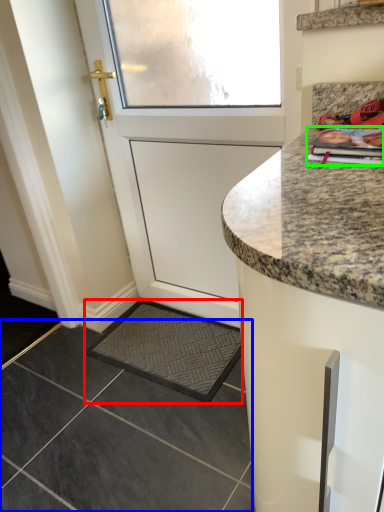
Question: Estimate the real-world distances between objects in this image. Which object is farther from slate (highlighted by a red box), granite (highlighted by a blue box) or magazine (highlighted by a green box)?

Choices:
 (A) granite
 (B) magazine

Answer: (B)